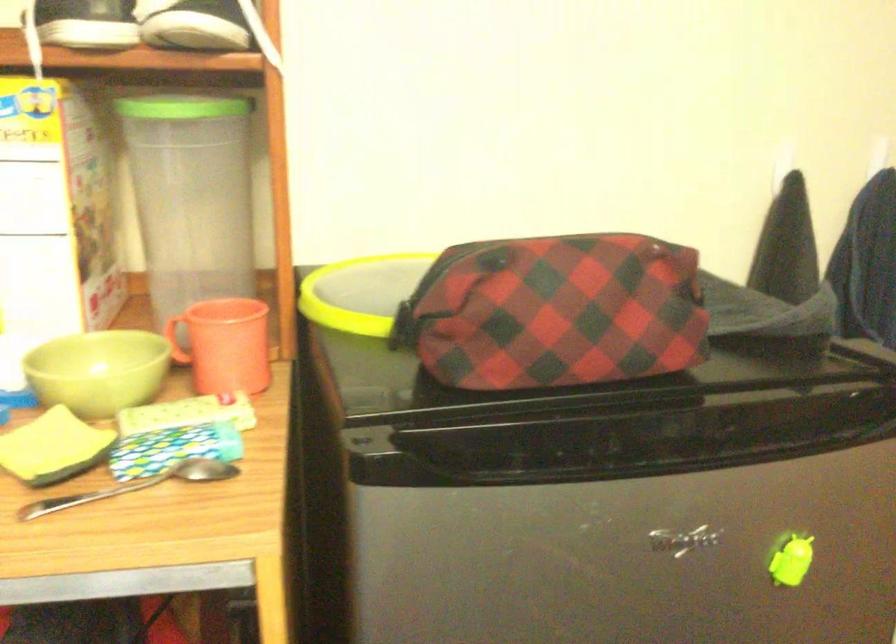
What do you see at coordinates (191, 196) in the screenshot? I see `the green container lid` at bounding box center [191, 196].